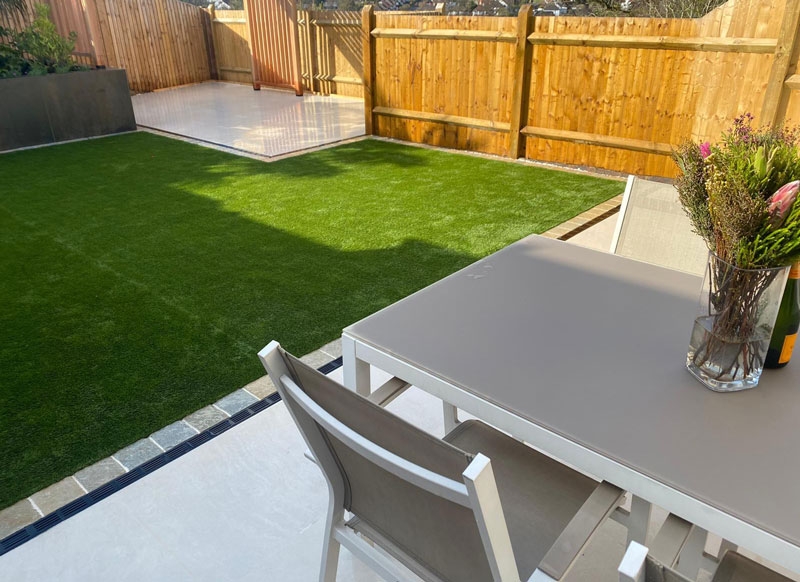
Identify the location of table. The height and width of the screenshot is (582, 800). point(556,379), point(726,455).